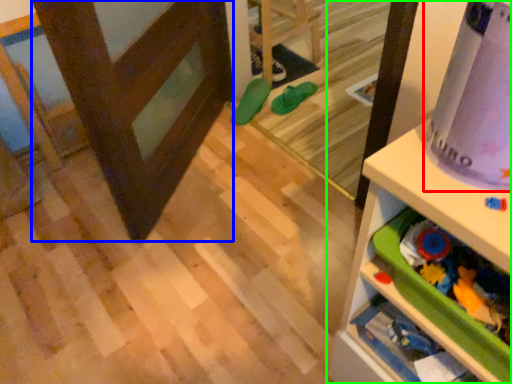
Question: Estimate the real-world distances between objects in this image. Which object is closer to wrapping paper (highlighted by a red box), screen door (highlighted by a blue box) or shelf (highlighted by a green box)?

Choices:
 (A) screen door
 (B) shelf

Answer: (B)